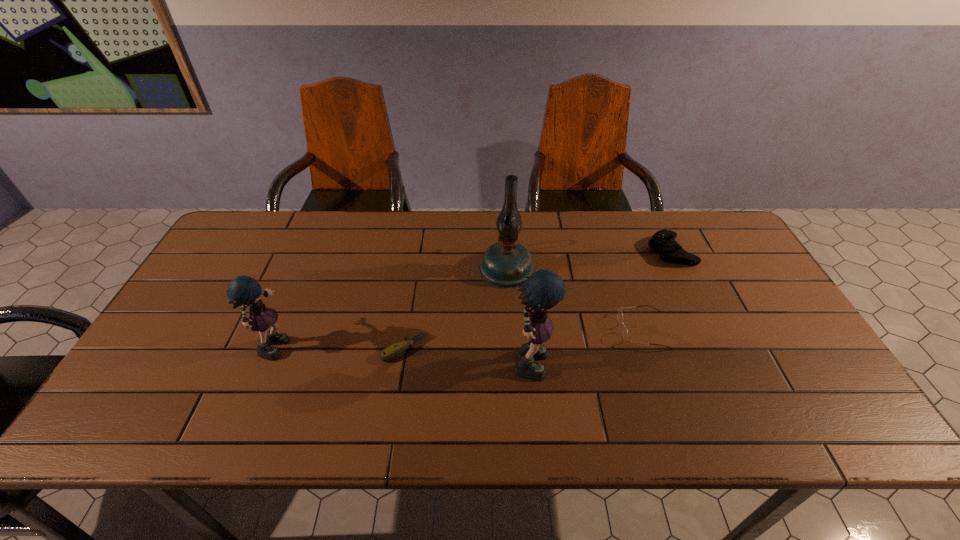
Where is `unoccupied position between the oil lamp and the fifth object from left to right`? unoccupied position between the oil lamp and the fifth object from left to right is located at coordinates (575, 299).

Find the location of a particular element. vacant point located between the spectacles and the leftmost object is located at coordinates (460, 336).

At what (x,y) coordinates should I click in order to perform the action: click on free space between the fourth shortest object and the control. Please return your answer as a coordinate pair (x, y). The width and height of the screenshot is (960, 540). Looking at the image, I should click on (473, 296).

The image size is (960, 540). Find the location of `free point between the taller rag doll and the shortest object`. free point between the taller rag doll and the shortest object is located at coordinates (468, 353).

What are the coordinates of `vacant point located between the taller rag doll and the oil lamp` in the screenshot? It's located at (518, 313).

At what (x,y) coordinates should I click in order to perform the action: click on the fifth closest object to the rightmost object. Please return your answer as a coordinate pair (x, y). Looking at the image, I should click on (245, 290).

Locate which object ranks third in proximity to the shortest object. Please provide its 2D coordinates. Your answer should be formatted as a tuple, i.e. [(x, y)], where the tuple contains the x and y coordinates of a point satisfying the conditions above.

[(245, 290)]

I want to click on free space in the image that satisfies the following two spatial constraints: 1. on the front side of the oil lamp; 2. on the front-facing side of the left rag doll, so click(512, 343).